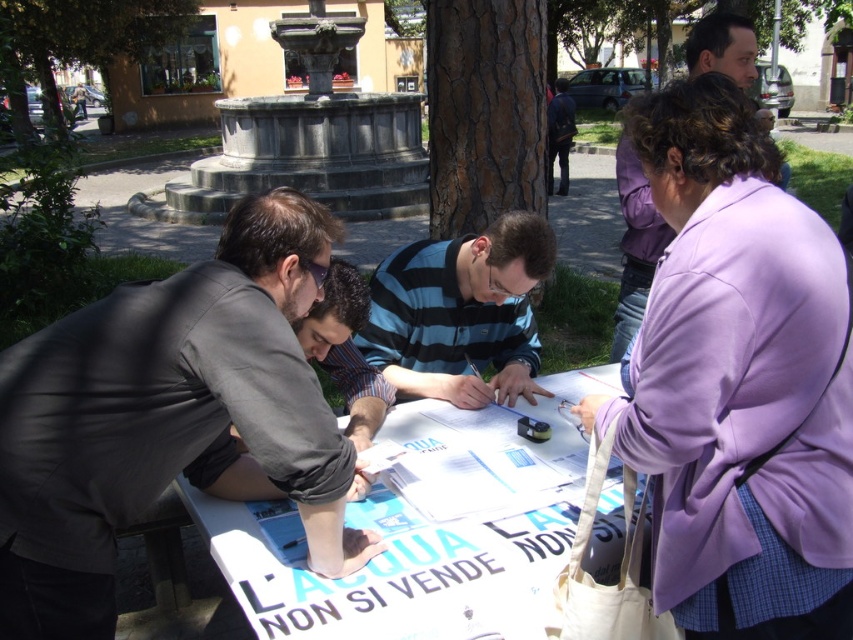
Which is below, purple fabric coat at upper right or white paper at center?

white paper at center

How much distance is there between purple fabric coat at upper right and white paper at center?

A distance of 19.32 inches exists between purple fabric coat at upper right and white paper at center.

Measure the distance between point (766,618) and camera.

The distance of point (766,618) from camera is 1.45 meters.

At what (x,y) coordinates should I click in order to perform the action: click on purple fabric coat at upper right. Please return your answer as a coordinate pair (x, y). The image size is (853, 640). Looking at the image, I should click on tap(738, 381).

Which of these two, white paper at center or purple fabric jacket at upper right, stands taller?

Standing taller between the two is purple fabric jacket at upper right.

Which is in front, point (526, 499) or point (660, 234)?

Point (526, 499)

Locate an element on the screen. Image resolution: width=853 pixels, height=640 pixels. white paper at center is located at coordinates (424, 540).

Between purple fabric coat at upper right and dark gray suit at left, which one is positioned lower?

Positioned lower is dark gray suit at left.

Can you confirm if purple fabric coat at upper right is smaller than dark gray suit at left?

No, purple fabric coat at upper right is not smaller than dark gray suit at left.

Identify the location of purple fabric coat at upper right. The image size is (853, 640). (738, 381).

You are a GUI agent. You are given a task and a screenshot of the screen. Output one action in this format:
    pyautogui.click(x=<x>, y=<y>)
    Task: Click on the purple fabric coat at upper right
    This screenshot has width=853, height=640.
    Given the screenshot: What is the action you would take?
    click(738, 381)